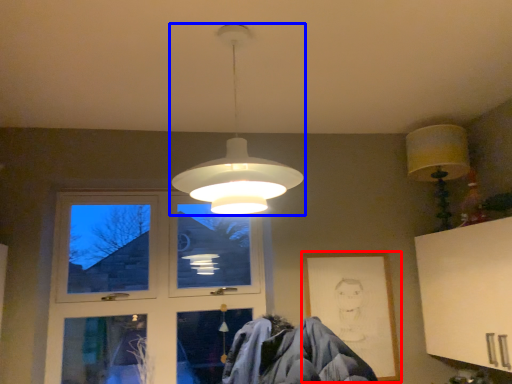
Question: Which object is further to the camera taking this photo, picture frame (highlighted by a red box) or lamp (highlighted by a blue box)?

Choices:
 (A) picture frame
 (B) lamp

Answer: (A)